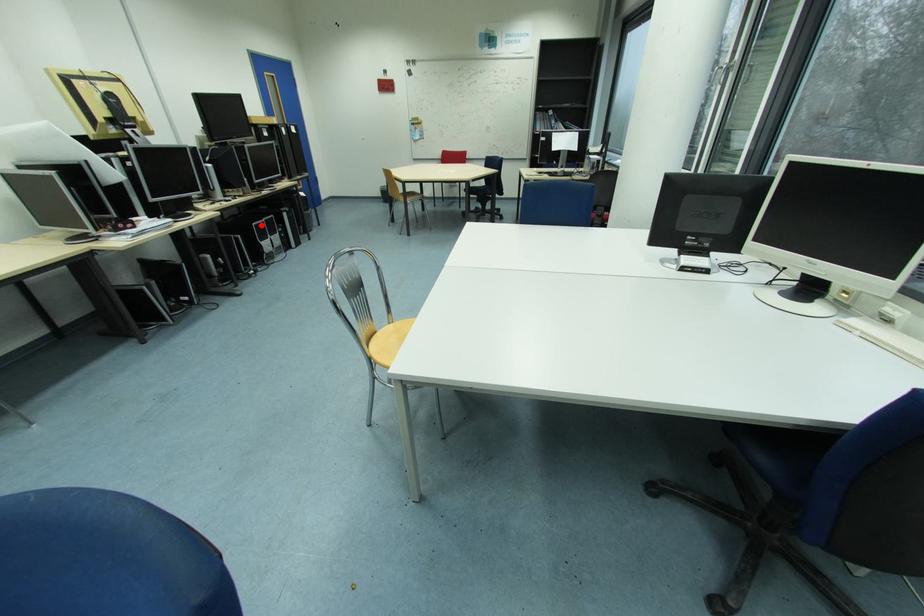
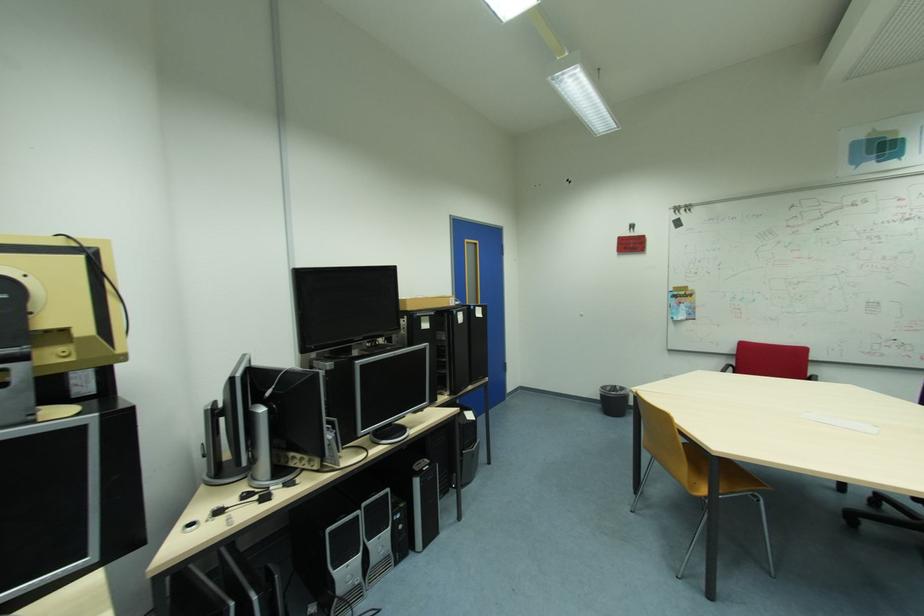
Where in the second image is the point corresponding to the highlighted location from the first image?

(335, 530)